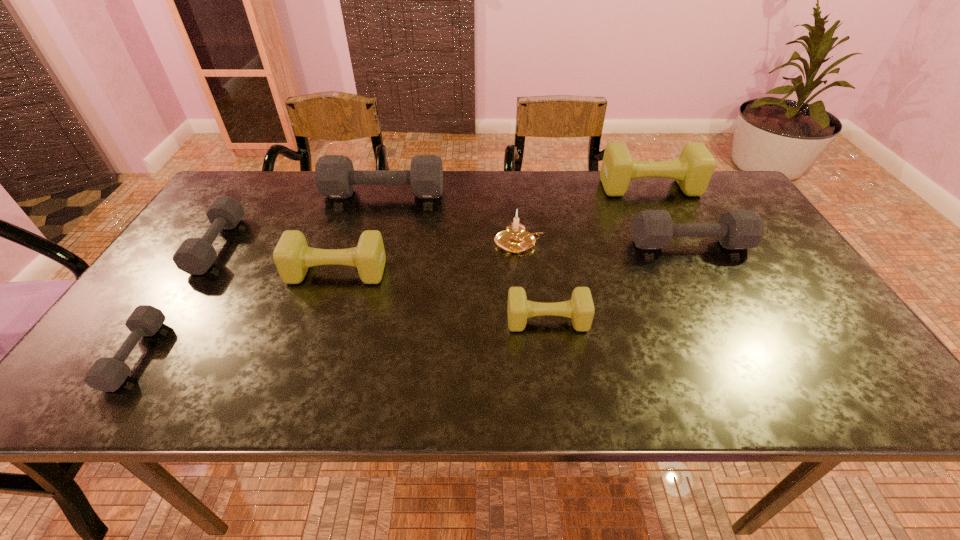
Locate an element on the screen. the second olive dumbbell from left to right is located at coordinates (580, 308).

The image size is (960, 540). I want to click on the smallest gray dumbbell, so click(x=107, y=374).

You are a GUI agent. You are given a task and a screenshot of the screen. Output one action in this format:
    pyautogui.click(x=<x>, y=<y>)
    Task: Click on the shortest dumbbell
    Image resolution: width=960 pixels, height=540 pixels.
    Given the screenshot: What is the action you would take?
    pyautogui.click(x=107, y=374)

Locate an element on the screen. This screenshot has height=540, width=960. vacant space located on the left of the biggest olive dumbbell is located at coordinates (507, 187).

Find the location of a particular element. This screenshot has height=540, width=960. free space located on the front of the farthest gray dumbbell is located at coordinates (372, 239).

Identify the location of free space located on the handle side of the candle holder. (612, 243).

You are a GUI agent. You are given a task and a screenshot of the screen. Output one action in this format:
    pyautogui.click(x=<x>, y=<y>)
    Task: Click on the blank area located on the front of the second biggest olive dumbbell
    The image size is (960, 540).
    Given the screenshot: What is the action you would take?
    pyautogui.click(x=300, y=378)

At what (x,y) coordinates should I click in order to perform the action: click on vacant space located 0.320m on the left of the second biggest gray dumbbell. Please return your answer as a coordinate pair (x, y). This screenshot has height=540, width=960. Looking at the image, I should click on (516, 245).

The image size is (960, 540). I want to click on vacant space situated 0.110m on the front of the second smallest gray dumbbell, so click(175, 309).

Image resolution: width=960 pixels, height=540 pixels. Identify the location of vacant area located 0.130m on the back of the fifth dumbbell from left to right. (540, 270).